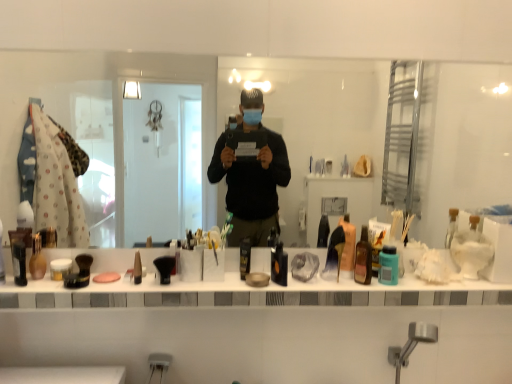
Question: Is white matte jar at center, the 8th toiletry viewed from the right, to the right of matte black brush at center, positioned as the seventh toiletry in right-to-left order, from the viewer's perspective?

Choices:
 (A) no
 (B) yes

Answer: (A)

Question: Is white matte jar at center, the 8th toiletry viewed from the right, facing towards matte black brush at center, positioned as the seventh toiletry in right-to-left order?

Choices:
 (A) no
 (B) yes

Answer: (A)

Question: Is white matte jar at center, the 8th toiletry viewed from the right, completely or partially outside of matte black brush at center, positioned as the seventh toiletry in right-to-left order?

Choices:
 (A) yes
 (B) no

Answer: (A)

Question: Is white matte jar at center, the 8th toiletry viewed from the right, next to matte black brush at center, acting as the 4th toiletry starting from the left?

Choices:
 (A) yes
 (B) no

Answer: (B)

Question: Would you say white matte jar at center, the 8th toiletry viewed from the right, contains matte black brush at center, positioned as the seventh toiletry in right-to-left order?

Choices:
 (A) yes
 (B) no

Answer: (B)

Question: From the image's perspective, relative to matte black shaving brush at left, the first toiletry in the left-to-right sequence, is translucent plastic bottle at center, marked as the ninth toiletry in a left-to-right arrangement, above or below?

Choices:
 (A) below
 (B) above

Answer: (B)

Question: Is translucent plastic bottle at center, which is counted as the second toiletry, starting from the right, inside the boundaries of matte black shaving brush at left, the first toiletry in the left-to-right sequence, or outside?

Choices:
 (A) inside
 (B) outside

Answer: (B)

Question: Is translucent plastic bottle at center, marked as the ninth toiletry in a left-to-right arrangement, in front of or behind matte black shaving brush at left, positioned as the 10th toiletry in right-to-left order, in the image?

Choices:
 (A) front
 (B) behind

Answer: (B)

Question: Visually, is translucent plastic bottle at center, which is counted as the second toiletry, starting from the right, positioned to the left or to the right of matte black shaving brush at left, positioned as the 10th toiletry in right-to-left order?

Choices:
 (A) right
 (B) left

Answer: (A)

Question: From a real-world perspective, is translucent plastic bottle at center, marked as the ninth toiletry in a left-to-right arrangement, above or below transparent glass mirror at center?

Choices:
 (A) above
 (B) below

Answer: (B)

Question: From the image's perspective, is translucent plastic bottle at center, marked as the ninth toiletry in a left-to-right arrangement, located above or below transparent glass mirror at center?

Choices:
 (A) above
 (B) below

Answer: (B)

Question: Is point (377, 256) closer or farther from the camera than point (433, 188)?

Choices:
 (A) farther
 (B) closer

Answer: (B)

Question: Based on their sizes in the image, would you say translucent plastic bottle at center, which is counted as the second toiletry, starting from the right, is bigger or smaller than transparent glass mirror at center?

Choices:
 (A) big
 (B) small

Answer: (B)

Question: Would you say pink matte soap at center is inside or outside black matte container at center, which ranks as the fifth toiletry in left-to-right order?

Choices:
 (A) inside
 (B) outside

Answer: (B)

Question: From their relative heights in the image, would you say pink matte soap at center is taller or shorter than black matte container at center, arranged as the sixth toiletry when viewed from the right?

Choices:
 (A) short
 (B) tall

Answer: (A)